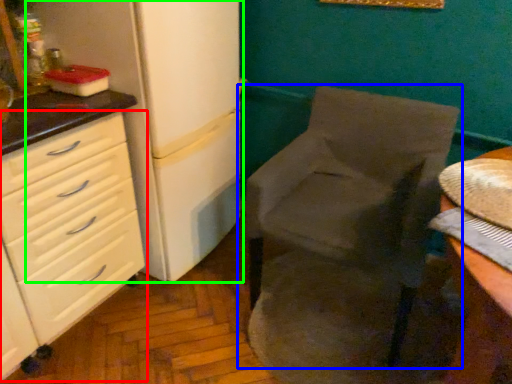
Question: Based on their relative distances, which object is farther from chest of drawers (highlighted by a red box)? Choose from chair (highlighted by a blue box) and refrigerator (highlighted by a green box).

Choices:
 (A) chair
 (B) refrigerator

Answer: (A)